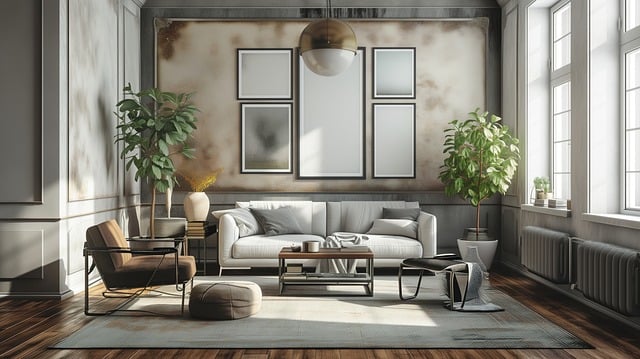
At what (x,y) coordinates should I click in order to perform the action: click on walls. Please return your answer as a coordinate pair (x, y). Looking at the image, I should click on (27, 135), (182, 80), (511, 88).